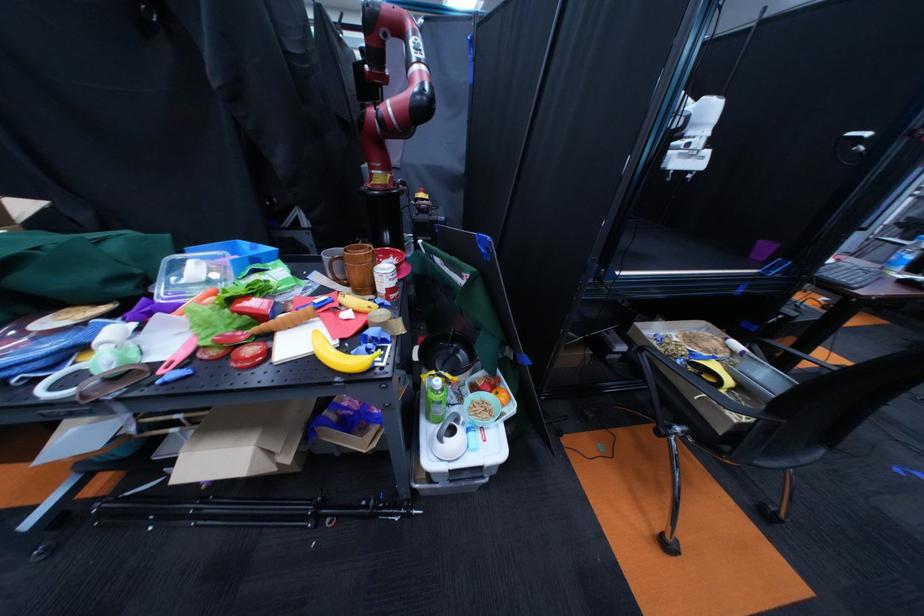
Where is `black chair armrest`? black chair armrest is located at coordinates (768, 416).